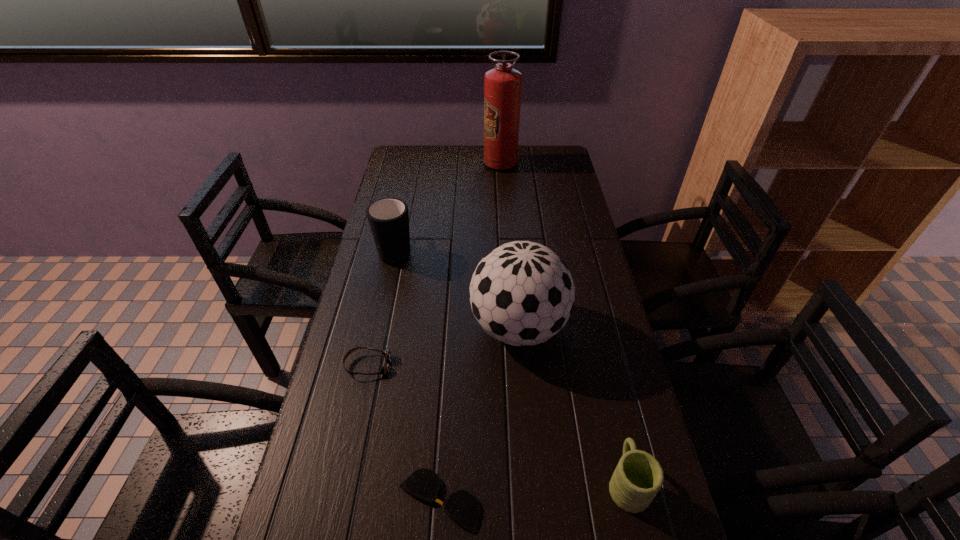
Locate an element on the screen. Image resolution: width=960 pixels, height=540 pixels. free space between the fire extinguisher and the shortest object is located at coordinates (469, 332).

Where is `free spot between the soccer ball and the fifth nearest object`? The image size is (960, 540). free spot between the soccer ball and the fifth nearest object is located at coordinates (457, 288).

The width and height of the screenshot is (960, 540). Find the location of `free spot between the goggles and the nearer mug`. free spot between the goggles and the nearer mug is located at coordinates (497, 424).

At what (x,y) coordinates should I click in order to perform the action: click on empty space that is in between the spectacles and the fifth nearest object. Please return your answer as a coordinate pair (x, y). The height and width of the screenshot is (540, 960). Looking at the image, I should click on (418, 375).

You are a GUI agent. You are given a task and a screenshot of the screen. Output one action in this format:
    pyautogui.click(x=<x>, y=<y>)
    Task: Click on the vacant point located between the goggles and the fifth shortest object
    
    Given the screenshot: What is the action you would take?
    pyautogui.click(x=444, y=346)

The image size is (960, 540). I want to click on vacant area that lies between the tallest object and the taller mug, so click(448, 206).

Find the location of a particular element. The width and height of the screenshot is (960, 540). free area in between the shortest object and the taller mug is located at coordinates (418, 375).

This screenshot has height=540, width=960. I want to click on vacant space that's between the spectacles and the second tallest object, so click(479, 414).

Locate an element on the screen. This screenshot has height=540, width=960. free area in between the farther mug and the soccer ball is located at coordinates (457, 288).

Select which object is the fifth closest to the shorter mug. Please provide its 2D coordinates. Your answer should be formatted as a tuple, i.e. [(x, y)], where the tuple contains the x and y coordinates of a point satisfying the conditions above.

[(502, 85)]